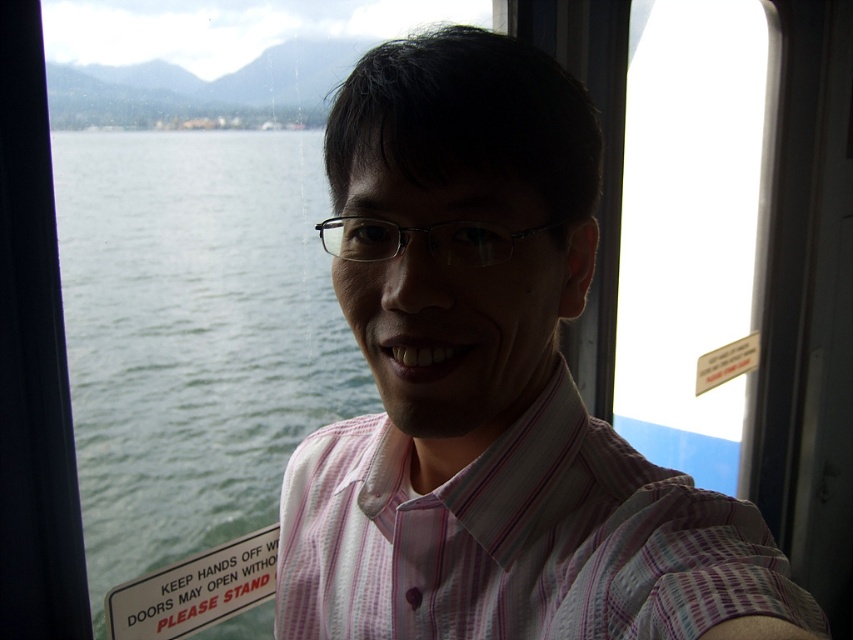
Question: Which object is positioned farthest from the green water at left?

Choices:
 (A) pink striped shirt at center
 (B) pink striped dress shirt at center

Answer: (B)

Question: Which point appears farthest from the camera in this image?

Choices:
 (A) (624, 490)
 (B) (721, 497)

Answer: (A)

Question: Can you confirm if green water at left is positioned above pink striped dress shirt at center?

Choices:
 (A) no
 (B) yes

Answer: (B)

Question: In this image, where is pink striped shirt at center located relative to pink striped dress shirt at center?

Choices:
 (A) left
 (B) right

Answer: (B)

Question: Among these objects, which one is nearest to the camera?

Choices:
 (A) green water at left
 (B) pink striped dress shirt at center

Answer: (B)

Question: Is green water at left wider than pink striped dress shirt at center?

Choices:
 (A) no
 (B) yes

Answer: (B)